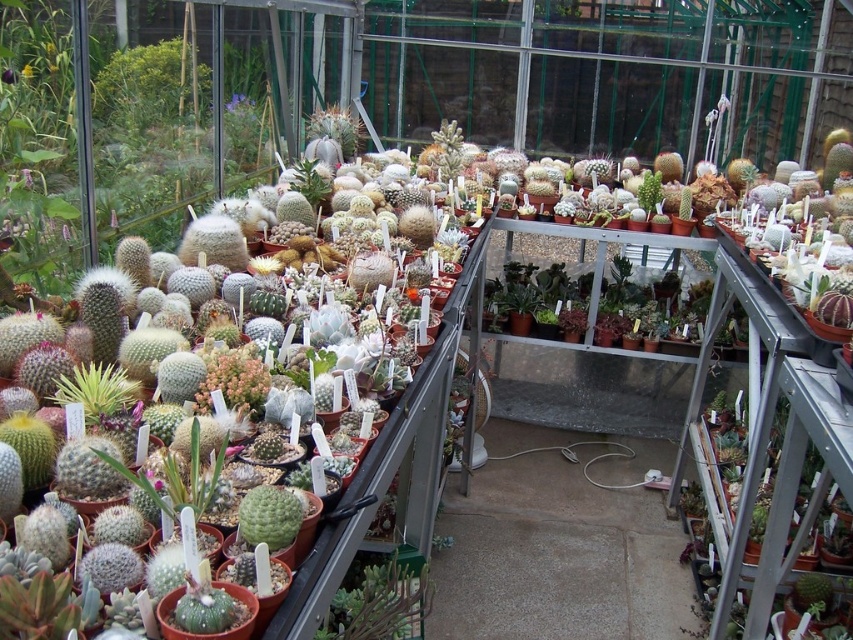
Question: Does green matte cactus at lower center appear on the left side of green fuzzy cactus at left?

Choices:
 (A) no
 (B) yes

Answer: (A)

Question: Is green matte cactus at lower center smaller than green fuzzy cactus at left?

Choices:
 (A) yes
 (B) no

Answer: (B)

Question: Which point is farther to the camera?

Choices:
 (A) (331, 134)
 (B) (117, 376)

Answer: (A)

Question: Considering the real-world distances, which object is farthest from the green matte cactus at lower center?

Choices:
 (A) green fuzzy cactus at center
 (B) green fuzzy cactus at left

Answer: (A)

Question: Can you confirm if green fuzzy cactus at left is positioned above green fuzzy cactus at center?

Choices:
 (A) no
 (B) yes

Answer: (A)

Question: Considering the real-world distances, which object is farthest from the green matte cactus at lower center?

Choices:
 (A) green fuzzy cactus at left
 (B) green fuzzy cactus at center

Answer: (B)